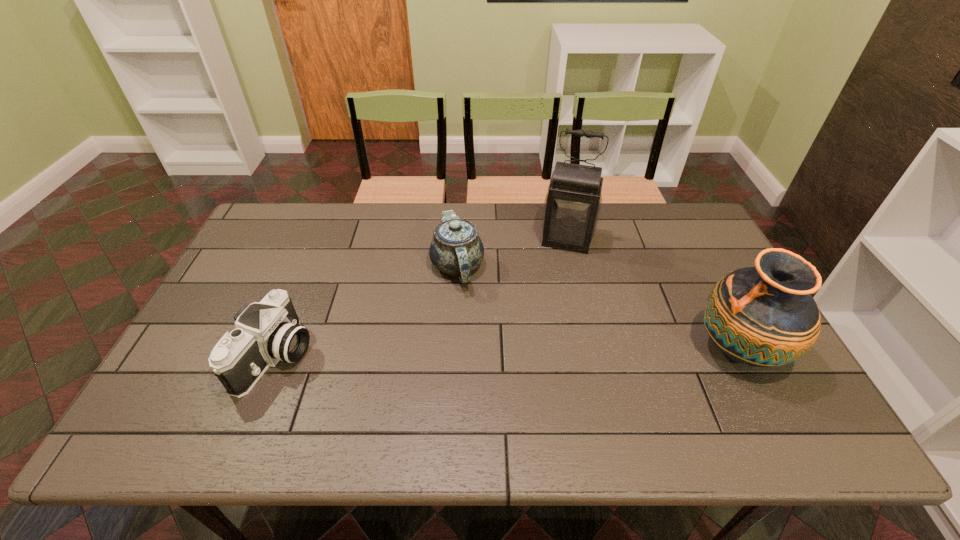
What are the coordinates of `free location located 0.400m on the front-facing side of the lantern` in the screenshot? It's located at (541, 353).

Where is `vacant position located 0.230m from the spout of the chinaware`? The height and width of the screenshot is (540, 960). vacant position located 0.230m from the spout of the chinaware is located at coordinates click(x=440, y=363).

The image size is (960, 540). In order to click on vacant region located from the spout of the chinaware in this screenshot , I will do `click(439, 369)`.

This screenshot has height=540, width=960. I want to click on free space located 0.270m from the spout of the chinaware, so click(x=437, y=376).

Where is `lantern that is at the far edge`? The height and width of the screenshot is (540, 960). lantern that is at the far edge is located at coordinates (572, 205).

This screenshot has width=960, height=540. I want to click on chinaware situated at the far edge, so click(x=456, y=249).

This screenshot has height=540, width=960. I want to click on camera that is at the near edge, so click(x=266, y=332).

The image size is (960, 540). I want to click on pottery that is at the near edge, so click(x=763, y=316).

Find the location of a particular element. The height and width of the screenshot is (540, 960). object that is at the left edge is located at coordinates (266, 332).

Where is `object that is at the right edge`? This screenshot has width=960, height=540. object that is at the right edge is located at coordinates (763, 316).